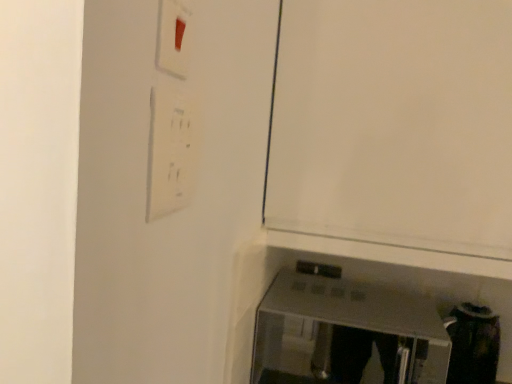
Question: Is white matte door at center taller or shorter than satin silver toaster at lower right?

Choices:
 (A) tall
 (B) short

Answer: (A)

Question: From a real-world perspective, is white matte door at center above or below satin silver toaster at lower right?

Choices:
 (A) below
 (B) above

Answer: (B)

Question: Which object is the closest to the white matte door at center?

Choices:
 (A) white plastic light switch at upper left
 (B) satin silver toaster at lower right

Answer: (A)

Question: Which object is the closest to the white matte door at center?

Choices:
 (A) satin silver toaster at lower right
 (B) white plastic light switch at upper left

Answer: (B)